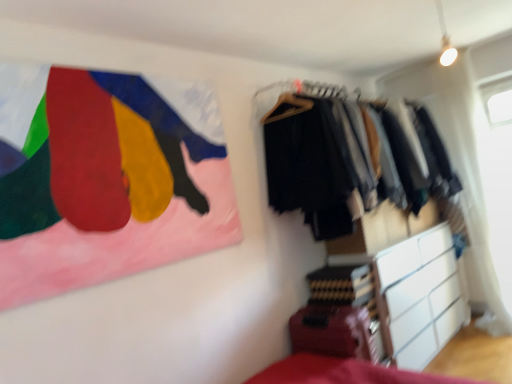
Question: Does point (392, 114) appear closer or farther from the camera than point (386, 339)?

Choices:
 (A) farther
 (B) closer

Answer: (A)

Question: From a real-world perspective, is textured fabric clothes at right above or below white matte chest of drawers at lower right?

Choices:
 (A) above
 (B) below

Answer: (A)

Question: Which is nearer to the textured fabric clothes at right?

Choices:
 (A) white matte chest of drawers at lower right
 (B) painted fabric flag at upper left
 (C) transparent plastic window screen at upper right

Answer: (A)

Question: Based on their relative distances, which object is farther from the painted fabric flag at upper left?

Choices:
 (A) white matte chest of drawers at lower right
 (B) transparent plastic window screen at upper right
 (C) textured fabric clothes at right

Answer: (B)